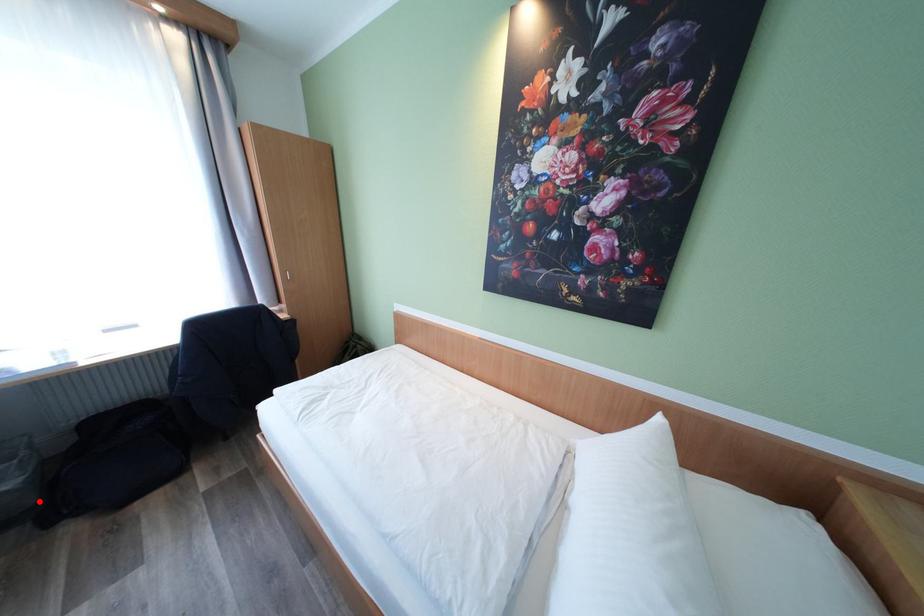
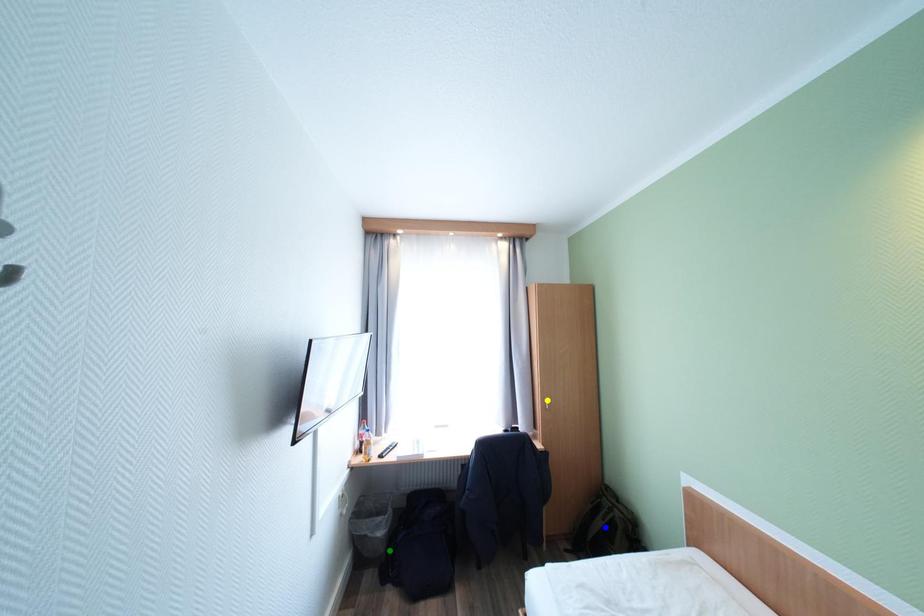
Question: I am providing you with two images of the same scene from different viewpoints. A red point is marked on the first image. You are given multiple points on the second image. Can you choose the point in image 2 that corresponds to the point in image 1?

Choices:
 (A) yellow point
 (B) blue point
 (C) green point

Answer: (C)